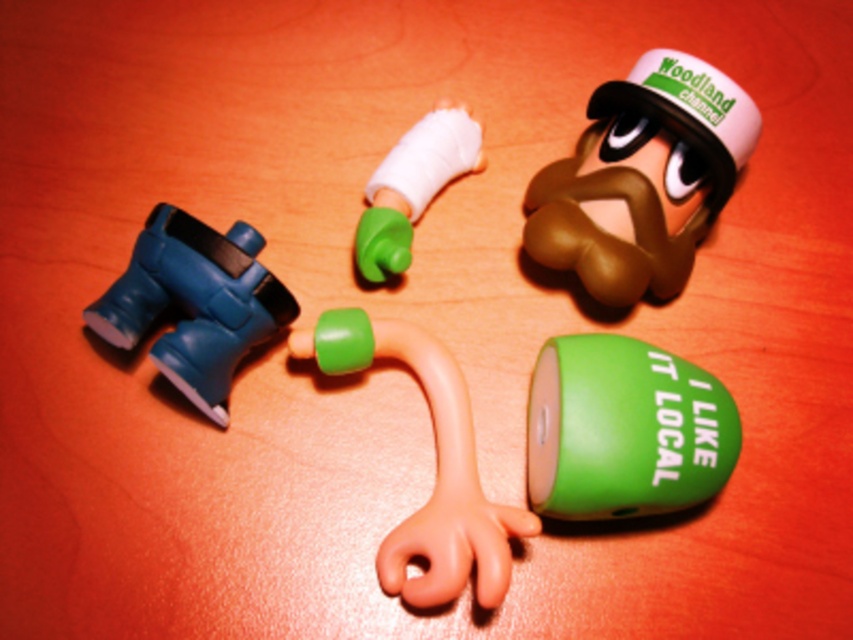
Question: Is green matte figure at upper center above green matte speaker at lower right?

Choices:
 (A) no
 (B) yes

Answer: (B)

Question: Which object is closer to the camera taking this photo?

Choices:
 (A) green matte bandage at center
 (B) green matte speaker at lower right

Answer: (B)

Question: Can you confirm if rubber hand at center is bigger than green matte bandage at center?

Choices:
 (A) yes
 (B) no

Answer: (A)

Question: Which object is closer to the camera taking this photo?

Choices:
 (A) blue rubber boots at left
 (B) rubber hand at center
 (C) green matte figure at upper center
 (D) green matte bandage at center

Answer: (B)

Question: Which point appears closest to the camera in this image?

Choices:
 (A) (494, 508)
 (B) (151, 300)
 (C) (596, 506)
 (D) (396, 164)

Answer: (C)

Question: Is green matte figure at upper center further to camera compared to green matte bandage at center?

Choices:
 (A) no
 (B) yes

Answer: (A)